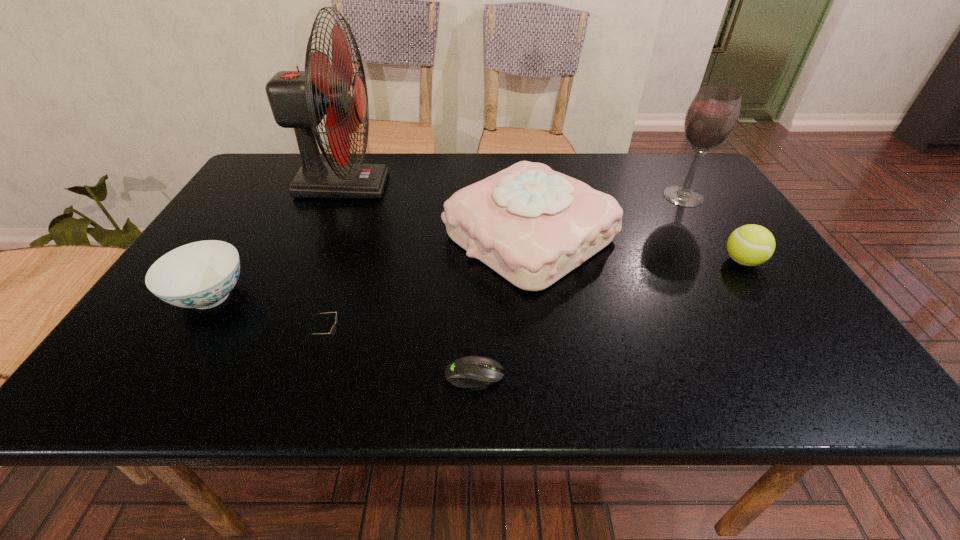
Select which object is the fifth closest to the alcohol. Please provide its 2D coordinates. Your answer should be formatted as a tuple, i.e. [(x, y)], where the tuple contains the x and y coordinates of a point satisfying the conditions above.

[(333, 329)]

Find the location of `free spot that satisfies the following two spatial constraints: 1. on the front-facing side of the tallest object; 2. on the left side of the fifth shortest object`. free spot that satisfies the following two spatial constraints: 1. on the front-facing side of the tallest object; 2. on the left side of the fifth shortest object is located at coordinates (321, 237).

Locate an element on the screen. This screenshot has width=960, height=540. vacant area in the image that satisfies the following two spatial constraints: 1. on the front-facing side of the fan; 2. on the left side of the fifth shortest object is located at coordinates (321, 237).

Find the location of a particular element. free region that satisfies the following two spatial constraints: 1. on the front-facing side of the fifth shortest object; 2. on the right side of the fan is located at coordinates [321, 237].